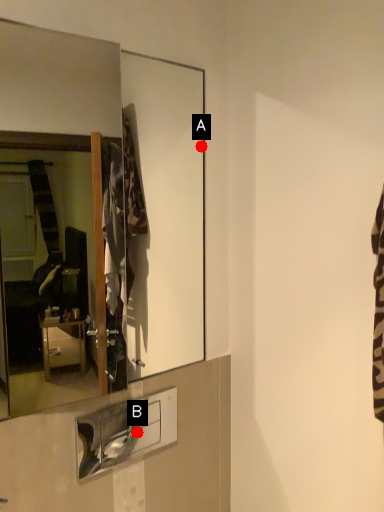
Question: Two points are circled on the image, labeled by A and B beside each circle. Which point is closer to the camera?

Choices:
 (A) A is closer
 (B) B is closer

Answer: (A)